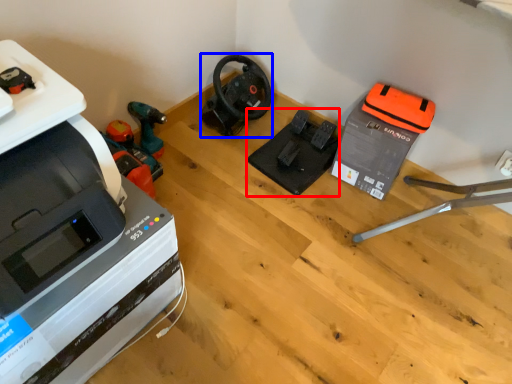
Question: Among these objects, which one is nearest to the camera, equipment (highlighted by a red box) or vacuum (highlighted by a blue box)?

Choices:
 (A) equipment
 (B) vacuum

Answer: (A)